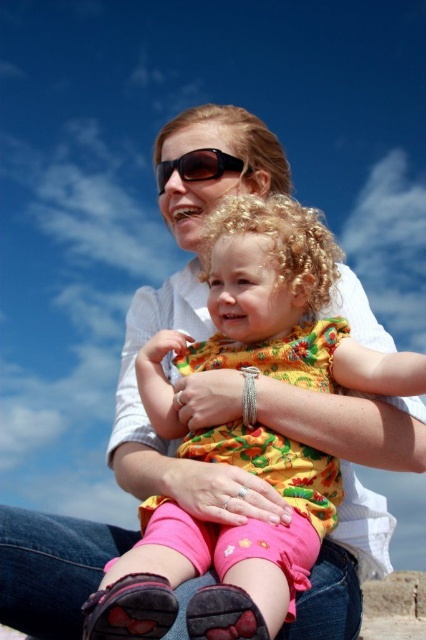
Question: Does floral cotton dress at center have a larger size compared to black plastic sunglasses at center?

Choices:
 (A) yes
 (B) no

Answer: (A)

Question: Can you confirm if floral cotton dress at center is positioned below black plastic sunglasses at center?

Choices:
 (A) no
 (B) yes

Answer: (B)

Question: Can you confirm if floral cotton dress at center is positioned above black plastic sunglasses at center?

Choices:
 (A) yes
 (B) no

Answer: (B)

Question: Which of the following is the farthest from the observer?

Choices:
 (A) (215, 177)
 (B) (299, 212)

Answer: (A)